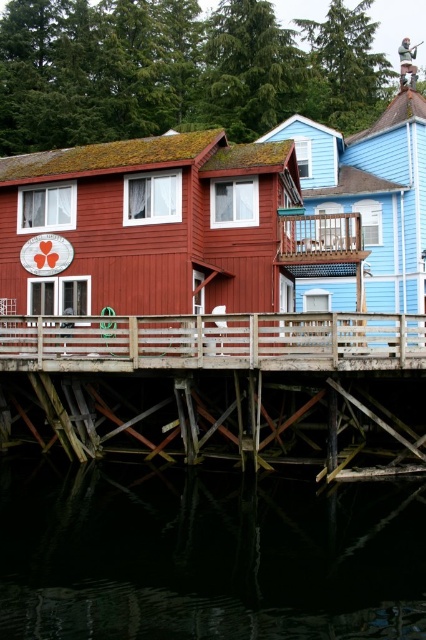
Which is above, dark reflective water at lower center or wooden at center?

wooden at center is above.

Consider the image. Is dark reflective water at lower center behind wooden at center?

No.

Does point (235, 588) come farther from viewer compared to point (196, 358)?

No, (235, 588) is closer to viewer.

What are the coordinates of `dark reflective water at lower center` in the screenshot? It's located at (204, 556).

Who is higher up, dark reflective water at lower center or wooden at lower center?

wooden at lower center is above.

Who is more forward, (233, 529) or (51, 438)?

Point (233, 529)

I want to click on dark reflective water at lower center, so click(204, 556).

Does point (311, 424) come closer to viewer compared to point (184, 365)?

No, it is not.

Between point (412, 422) and point (13, 369), which one is positioned in front?

Positioned in front is point (13, 369).

What are the coordinates of `wooden at lower center` in the screenshot? It's located at (221, 387).